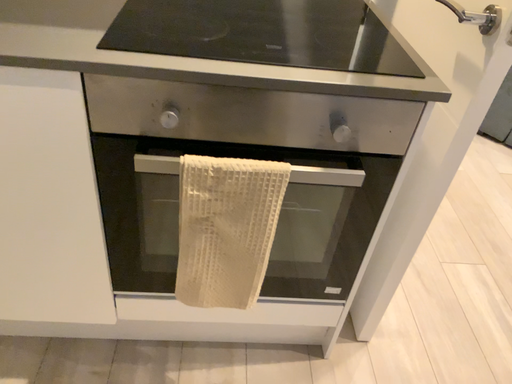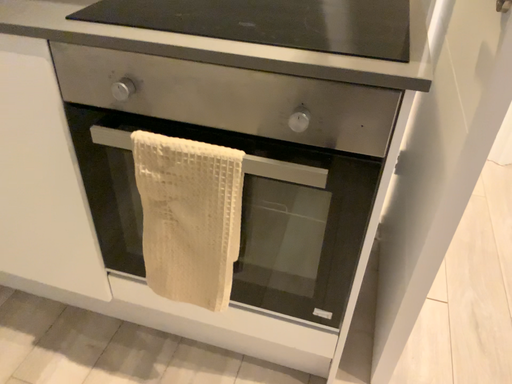
Question: Which way did the camera rotate in the video?

Choices:
 (A) rotated left
 (B) rotated right

Answer: (A)